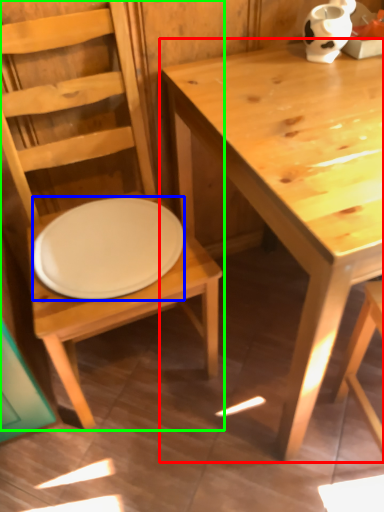
Question: Which is nearer to the table (highlighted by a red box)? plate (highlighted by a blue box) or chair (highlighted by a green box).

Choices:
 (A) plate
 (B) chair

Answer: (B)